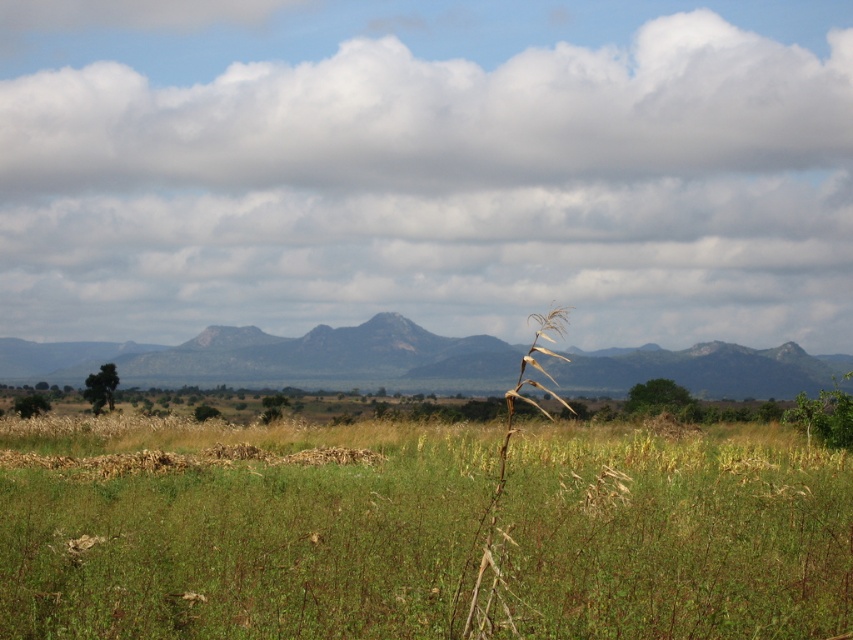
Question: Which of these objects is positioned farthest from the green grassy at center?

Choices:
 (A) brown dry stalk at center
 (B) rocky gray mountain at center
 (C) white fluffy cloud at upper center

Answer: (C)

Question: Which of the following is the closest to the observer?

Choices:
 (A) (553, 353)
 (B) (834, 554)
 (C) (136, 93)
 (D) (383, 353)

Answer: (A)

Question: Does rocky gray mountain at center appear under brown dry stalk at center?

Choices:
 (A) no
 (B) yes

Answer: (A)

Question: Which point is closer to the camera taking this photo?

Choices:
 (A) (579, 497)
 (B) (553, 332)

Answer: (B)

Question: Does green grassy at center lie behind brown dry stalk at center?

Choices:
 (A) no
 (B) yes

Answer: (B)

Question: Can you confirm if rocky gray mountain at center is positioned to the left of brown dry stalk at center?

Choices:
 (A) yes
 (B) no

Answer: (A)